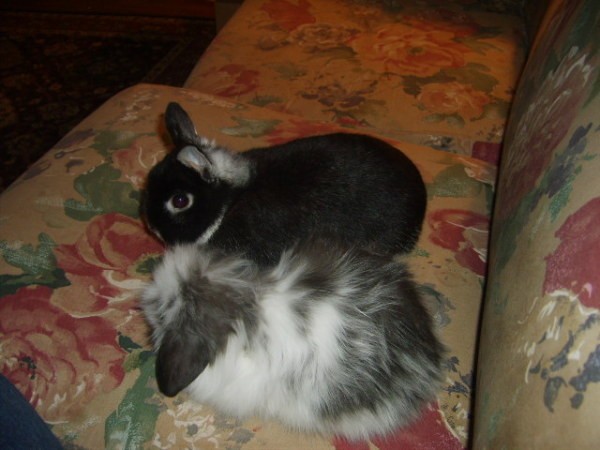
The width and height of the screenshot is (600, 450). What are the coordinates of `rug` in the screenshot? It's located at (147, 55).